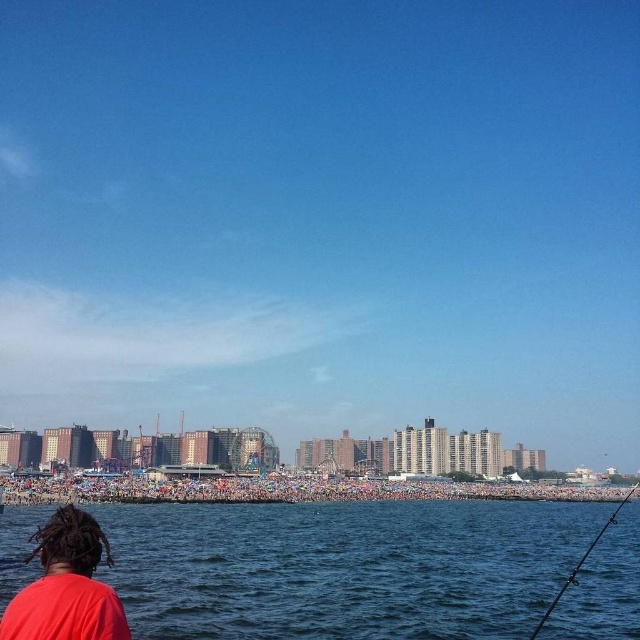
Question: Considering the relative positions of blue water at lower center and red matte shirt at lower left in the image provided, where is blue water at lower center located with respect to red matte shirt at lower left?

Choices:
 (A) right
 (B) left

Answer: (A)

Question: Estimate the real-world distances between objects in this image. Which object is closer to the blue water at lower center?

Choices:
 (A) black plastic fishing pole at lower right
 (B) red matte shirt at lower left

Answer: (A)

Question: Can you confirm if blue water at lower center is smaller than red matte shirt at lower left?

Choices:
 (A) yes
 (B) no

Answer: (B)

Question: Considering the real-world distances, which object is closest to the blue water at lower center?

Choices:
 (A) red matte shirt at lower left
 (B) black plastic fishing pole at lower right

Answer: (B)

Question: Does blue water at lower center appear on the right side of black plastic fishing pole at lower right?

Choices:
 (A) yes
 (B) no

Answer: (B)

Question: Which of these objects is positioned farthest from the blue water at lower center?

Choices:
 (A) black plastic fishing pole at lower right
 (B) red matte shirt at lower left

Answer: (B)